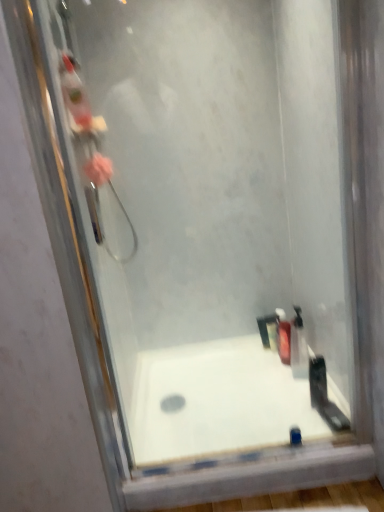
Locate an element on the screen. vacant space to the left of translucent plastic soap dispenser at lower right, the 3th toiletry when ordered from front to back is located at coordinates (254, 362).